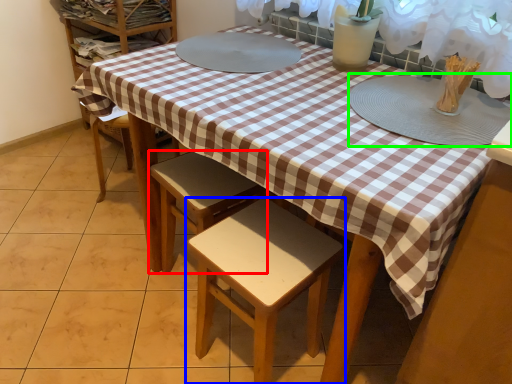
Question: Which object is positioned closest to stool (highlighted by a red box)? Select from stool (highlighted by a blue box) and platter (highlighted by a green box).

Choices:
 (A) stool
 (B) platter

Answer: (A)